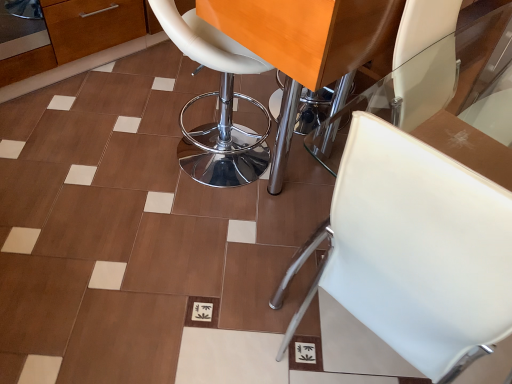
I want to click on free space to the left of white leather stool at center, the second chair positioned from the right, so click(118, 144).